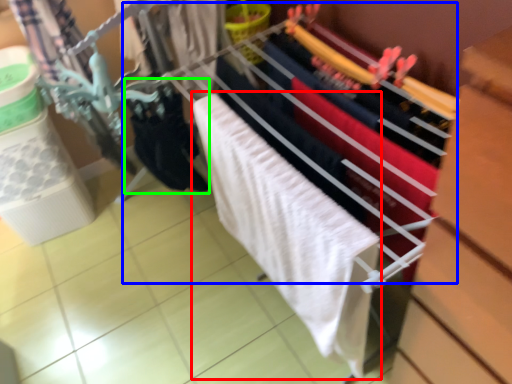
Question: Considering the real-world distances, which object is farthest from bath towel (highlighted by a red box)? closet (highlighted by a blue box) or clothing (highlighted by a green box)?

Choices:
 (A) closet
 (B) clothing

Answer: (B)